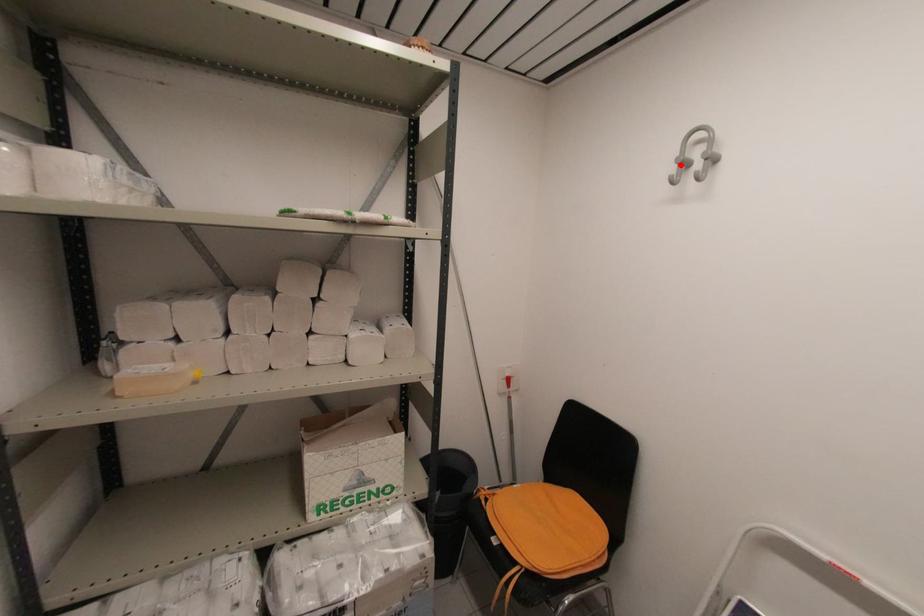
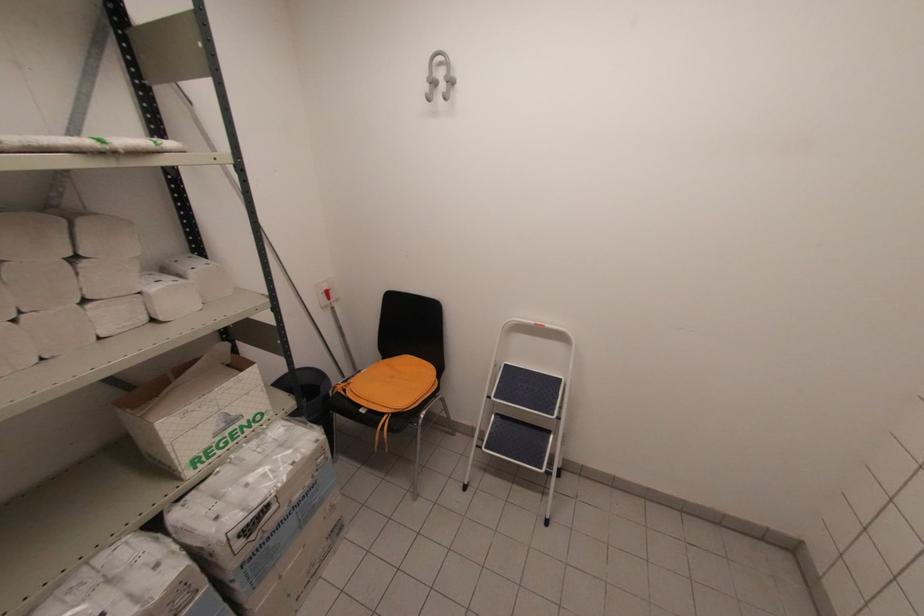
Locate, in the second image, the point that corresponds to the highlighted location in the first image.

(431, 84)